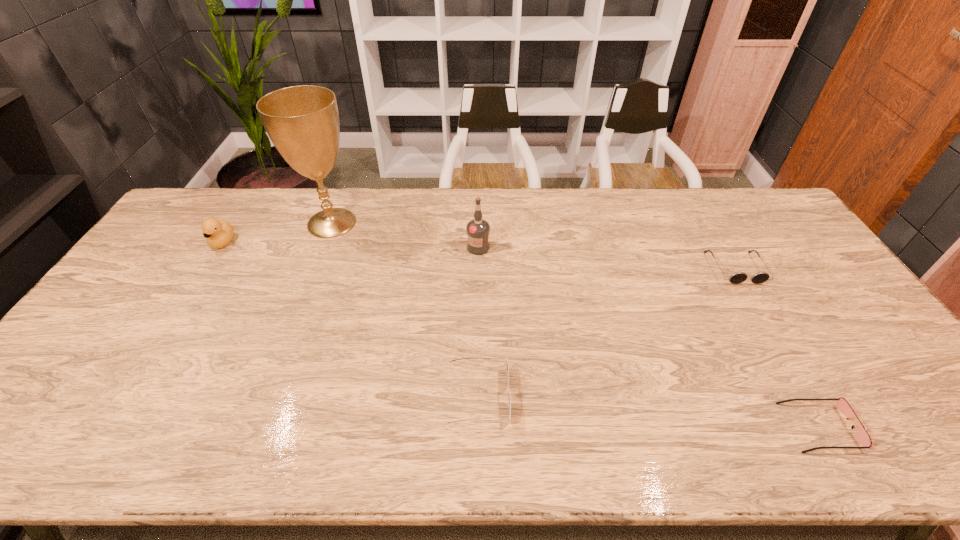
At what (x,y) coordinates should I click in order to perform the action: click on the tallest object. Please return your answer as a coordinate pair (x, y). Looking at the image, I should click on 302,122.

Identify the location of trophy cup. (302, 122).

The width and height of the screenshot is (960, 540). Identify the location of the second tallest object. (478, 230).

This screenshot has height=540, width=960. What are the coordinates of `the third tallest object` in the screenshot? It's located at (218, 234).

Find the location of a particular element. The height and width of the screenshot is (540, 960). duckling is located at coordinates (218, 234).

The image size is (960, 540). What are the coordinates of `the farthest sunglasses` in the screenshot? It's located at (738, 277).

This screenshot has width=960, height=540. Find the location of `the leftmost sunglasses`. the leftmost sunglasses is located at coordinates (508, 395).

The image size is (960, 540). In order to click on vacant space located 0.050m on the back of the second object from left to right in this screenshot , I will do `click(342, 197)`.

The width and height of the screenshot is (960, 540). Identify the location of vacant space located 0.110m on the front label of the fifth shortest object. (478, 280).

What are the coordinates of `vacant area situated on the face of the duckling` in the screenshot? It's located at (179, 313).